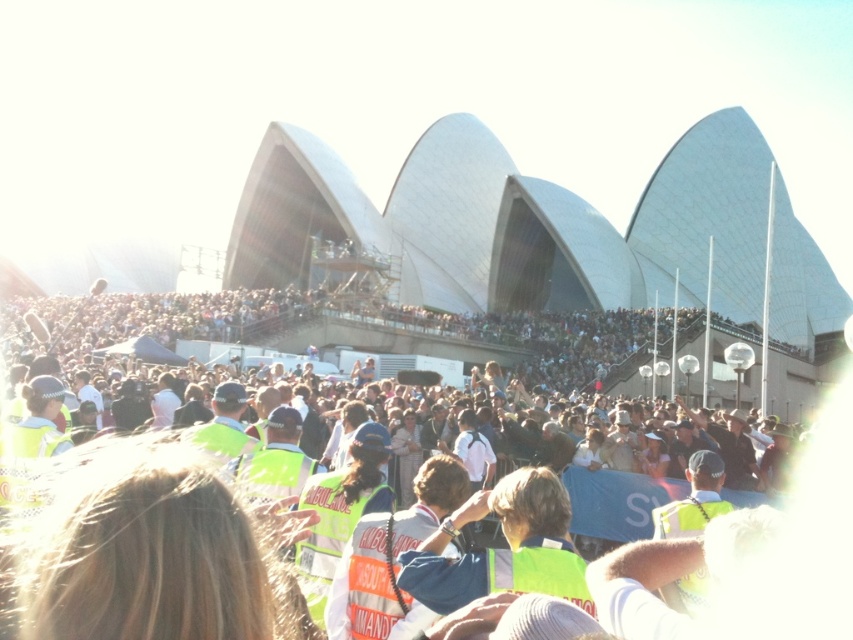
Question: Does green reflective vest at center have a smaller size compared to reflective orange safety vest at center?

Choices:
 (A) no
 (B) yes

Answer: (A)

Question: Which point is farther to the camera?

Choices:
 (A) (488, 586)
 (B) (369, 496)
 (C) (467, 436)
 (D) (351, 621)

Answer: (C)

Question: Which point is farther from the camera taking this photo?

Choices:
 (A) (535, 468)
 (B) (543, 346)
 (C) (317, 621)

Answer: (B)

Question: Is green reflective vest at center wider than reflective orange safety vest at center?

Choices:
 (A) no
 (B) yes

Answer: (B)

Question: Can you confirm if reflective orange vest at center is thinner than yellow reflective vest at center?

Choices:
 (A) yes
 (B) no

Answer: (B)

Question: Among these points, which one is farthest from the camera?

Choices:
 (A) (437, 454)
 (B) (444, 586)

Answer: (A)